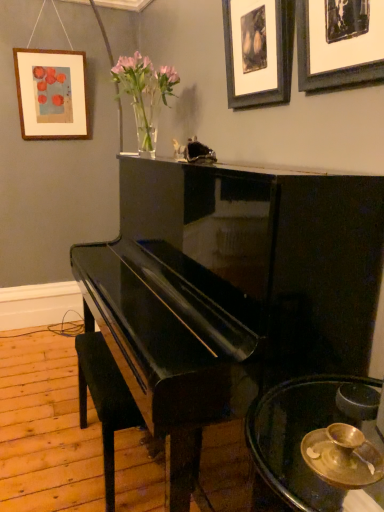
Question: From the image's perspective, is wooden picture frame at upper left, the third picture frame in the right-to-left sequence, located beneath translucent glass vase at upper center?

Choices:
 (A) no
 (B) yes

Answer: (A)

Question: Does wooden picture frame at upper left, placed as the 3th picture frame when sorted from front to back, have a lesser height compared to translucent glass vase at upper center?

Choices:
 (A) yes
 (B) no

Answer: (B)

Question: Is translucent glass vase at upper center surrounded by wooden picture frame at upper left, the third picture frame in the right-to-left sequence?

Choices:
 (A) yes
 (B) no

Answer: (B)

Question: Is wooden picture frame at upper left, placed as the 3th picture frame when sorted from front to back, to the right of translucent glass vase at upper center from the viewer's perspective?

Choices:
 (A) no
 (B) yes

Answer: (A)

Question: Does wooden picture frame at upper left, which is counted as the first picture frame, starting from the back, turn towards translucent glass vase at upper center?

Choices:
 (A) yes
 (B) no

Answer: (A)

Question: Is the depth of glossy black piano at center greater than that of black leather music stool at lower left?

Choices:
 (A) no
 (B) yes

Answer: (A)

Question: Is glossy black piano at center facing towards black leather music stool at lower left?

Choices:
 (A) no
 (B) yes

Answer: (B)

Question: Can you confirm if glossy black piano at center is smaller than black leather music stool at lower left?

Choices:
 (A) no
 (B) yes

Answer: (A)

Question: Is there a large distance between glossy black piano at center and black leather music stool at lower left?

Choices:
 (A) no
 (B) yes

Answer: (A)

Question: Is glossy black piano at center at the left side of black leather music stool at lower left?

Choices:
 (A) yes
 (B) no

Answer: (B)

Question: From the image's perspective, would you say glossy black piano at center is shown under black leather music stool at lower left?

Choices:
 (A) yes
 (B) no

Answer: (B)

Question: Considering the relative sizes of black matte picture frame at upper right, which ranks as the 1th picture frame in front-to-back order, and wooden picture frame at upper left, placed as the 3th picture frame when sorted from front to back, in the image provided, is black matte picture frame at upper right, which ranks as the 1th picture frame in front-to-back order, taller than wooden picture frame at upper left, placed as the 3th picture frame when sorted from front to back,?

Choices:
 (A) yes
 (B) no

Answer: (B)